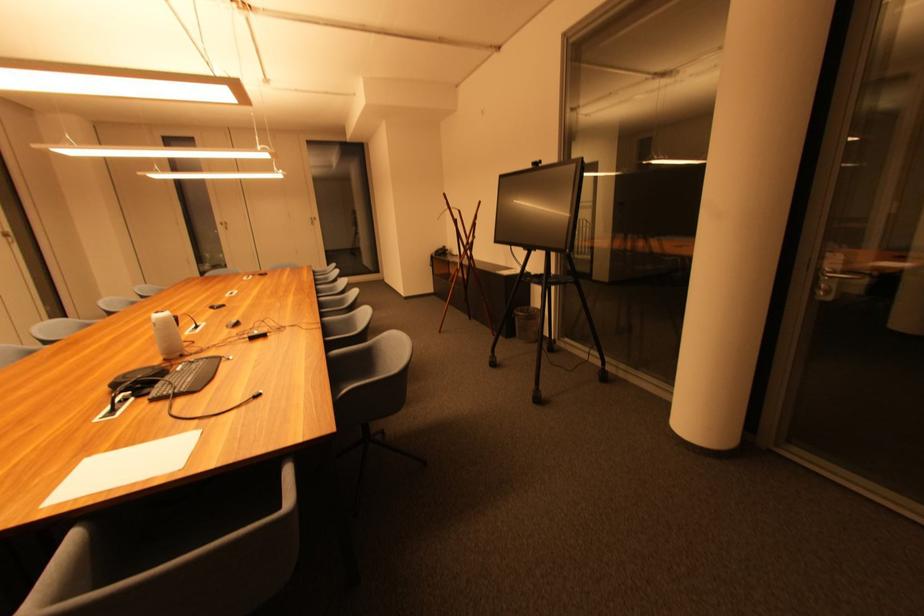
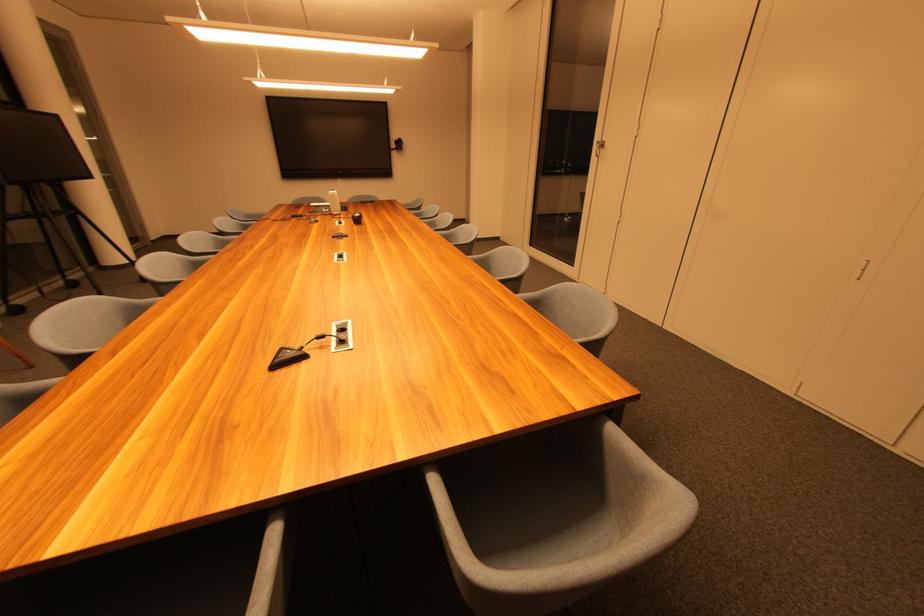
Question: I am providing you with two images of the same scene from different viewpoints. Please identify which objects are invisible in image2.

Choices:
 (A) red soap bar
 (B) gray water bottle
 (C) black conference phone
 (D) silver door handle

Answer: (C)